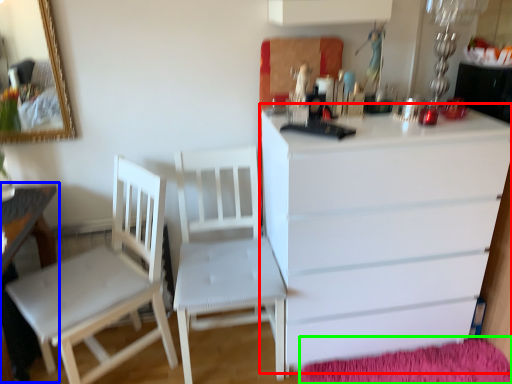
Question: Considering the real-world distances, which object is farthest from chest of drawers (highlighted by a red box)? table (highlighted by a blue box) or mat (highlighted by a green box)?

Choices:
 (A) table
 (B) mat

Answer: (A)